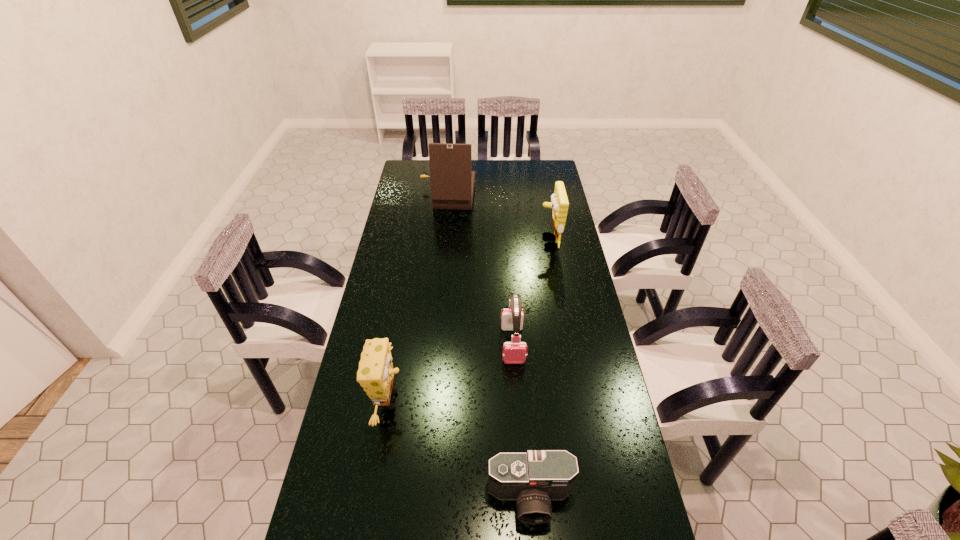
Locate an element on the screen. vacant space that is in between the nearer sponge and the nearest object is located at coordinates (460, 449).

Identify the location of vacant space that is in between the right sponge and the camera. click(x=540, y=370).

Point out which object is positioned as the second nearest to the rightmost object. Please provide its 2D coordinates. Your answer should be formatted as a tuple, i.e. [(x, y)], where the tuple contains the x and y coordinates of a point satisfying the conditions above.

[(514, 352)]

Identify which object is located as the nearest to the fourth nearest object. Please provide its 2D coordinates. Your answer should be formatted as a tuple, i.e. [(x, y)], where the tuple contains the x and y coordinates of a point satisfying the conditions above.

[(452, 180)]

The height and width of the screenshot is (540, 960). Identify the location of blank space that satisfies the following two spatial constraints: 1. on the outer surface of the earphone; 2. on the face of the shorter sponge. (516, 400).